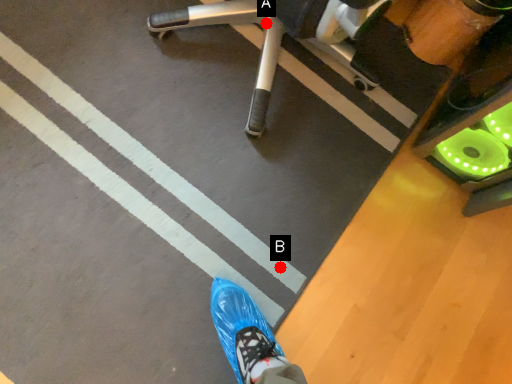
Question: Two points are circled on the image, labeled by A and B beside each circle. Among these points, which one is nearest to the camera?

Choices:
 (A) A is closer
 (B) B is closer

Answer: (B)